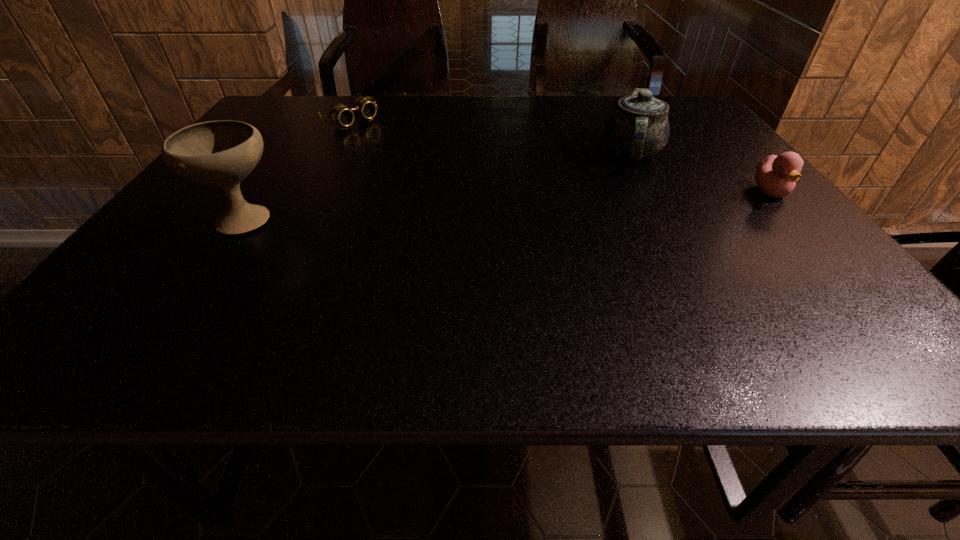
At what (x,y) coordinates should I click in order to perform the action: click on empty location between the shortest object and the rightmost object. Please return your answer as a coordinate pair (x, y). Looking at the image, I should click on (561, 157).

I want to click on free space between the goggles and the second shortest object, so click(561, 157).

Locate an element on the screen. Image resolution: width=960 pixels, height=540 pixels. vacant space in between the chalice and the goggles is located at coordinates (298, 170).

The height and width of the screenshot is (540, 960). I want to click on free spot between the second tallest object and the shortest object, so click(492, 137).

At what (x,y) coordinates should I click in order to perform the action: click on object that is the second closest to the goggles. Please return your answer as a coordinate pair (x, y). Image resolution: width=960 pixels, height=540 pixels. Looking at the image, I should click on (638, 127).

Where is `the second closest object to the third tallest object`? the second closest object to the third tallest object is located at coordinates (339, 114).

Locate an element on the screen. free space that satisfies the following two spatial constraints: 1. on the back side of the goggles; 2. on the right side of the chalice is located at coordinates (309, 121).

You are a GUI agent. You are given a task and a screenshot of the screen. Output one action in this format:
    pyautogui.click(x=<x>, y=<y>)
    Task: Click on the vacant space that satisfies the following two spatial constraints: 1. on the front side of the shortest object; 2. on the left side of the second tallest object
    
    Given the screenshot: What is the action you would take?
    pyautogui.click(x=336, y=152)